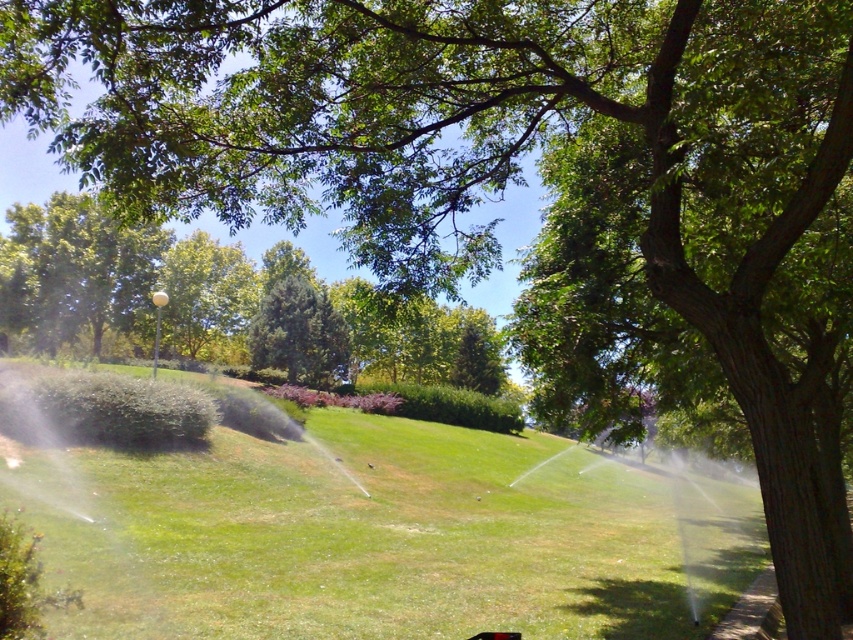
You are standing at point (384,536) in the scene. What is directly beneath your feet?

The point at (384,536) is directly on the green grass at center.

You are standing at the origin point of the image coordinate system. You want to walk to the green grass at center. What are the coordinates you need to move to?

The coordinates you need to move to are approximately 0.839 in the x direction and 0.451 in the y direction, as the green grass at center is located at point (384,536).